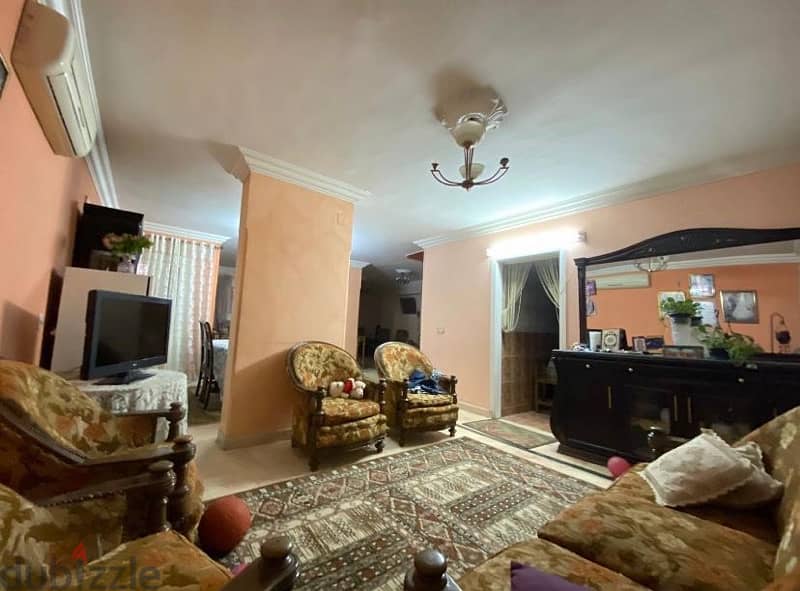
Identify the location of mirror. This screenshot has width=800, height=591. (630, 287).